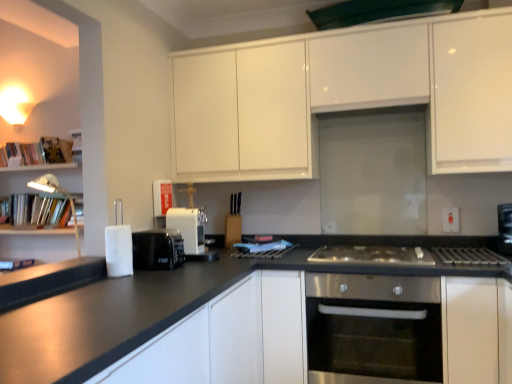
Question: Considering the relative sizes of stainless steel oven at center and green matte exhaust hood at upper center in the image provided, is stainless steel oven at center thinner than green matte exhaust hood at upper center?

Choices:
 (A) yes
 (B) no

Answer: (B)

Question: Considering the relative positions of stainless steel oven at center and green matte exhaust hood at upper center in the image provided, is stainless steel oven at center to the right of green matte exhaust hood at upper center from the viewer's perspective?

Choices:
 (A) no
 (B) yes

Answer: (A)

Question: Can you confirm if stainless steel oven at center is wider than green matte exhaust hood at upper center?

Choices:
 (A) no
 (B) yes

Answer: (B)

Question: Is stainless steel oven at center not inside green matte exhaust hood at upper center?

Choices:
 (A) no
 (B) yes

Answer: (B)

Question: Is the position of stainless steel oven at center less distant than that of green matte exhaust hood at upper center?

Choices:
 (A) yes
 (B) no

Answer: (A)

Question: In the image, is green matte exhaust hood at upper center positioned in front of or behind white plastic electric outlet at upper right?

Choices:
 (A) front
 (B) behind

Answer: (A)

Question: From the image's perspective, relative to white plastic electric outlet at upper right, is green matte exhaust hood at upper center above or below?

Choices:
 (A) below
 (B) above

Answer: (B)

Question: Would you say green matte exhaust hood at upper center is to the left or to the right of white plastic electric outlet at upper right in the picture?

Choices:
 (A) right
 (B) left

Answer: (B)

Question: Is green matte exhaust hood at upper center inside the boundaries of white plastic electric outlet at upper right, or outside?

Choices:
 (A) outside
 (B) inside

Answer: (A)

Question: Considering their positions, is white matte cabinet at lower right, the second cabinetry positioned from the top, located in front of or behind stainless steel gas stove at center?

Choices:
 (A) front
 (B) behind

Answer: (A)

Question: Considering the positions of point (493, 324) and point (438, 246), is point (493, 324) closer or farther from the camera than point (438, 246)?

Choices:
 (A) farther
 (B) closer

Answer: (B)

Question: From the image's perspective, is white matte cabinet at lower right, the second cabinetry positioned from the top, above or below stainless steel gas stove at center?

Choices:
 (A) below
 (B) above

Answer: (A)

Question: Looking at the image, does white matte cabinet at lower right, which appears as the 2th cabinetry when ordered from the bottom, seem bigger or smaller compared to stainless steel gas stove at center?

Choices:
 (A) big
 (B) small

Answer: (A)

Question: From a real-world perspective, is white glossy cabinet at upper center, acting as the third cabinetry starting from the bottom, physically located above or below white matte cabinet at lower right, which appears as the 2th cabinetry when ordered from the bottom?

Choices:
 (A) below
 (B) above

Answer: (B)

Question: Considering the positions of point (440, 36) and point (460, 319), is point (440, 36) closer or farther from the camera than point (460, 319)?

Choices:
 (A) farther
 (B) closer

Answer: (A)